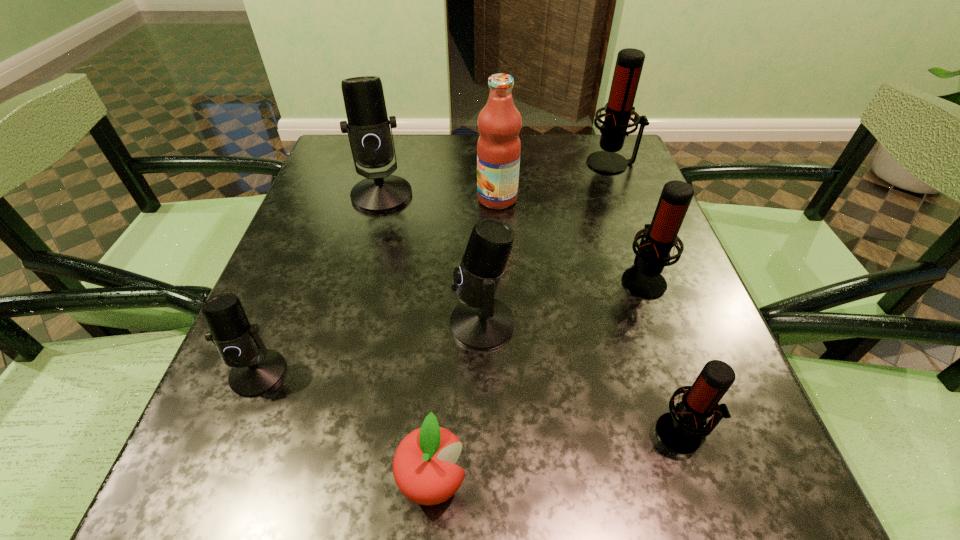
Find the location of a particular element. Image resolution: width=960 pixels, height=540 pixels. vacant space situated 0.230m on the back of the second biggest red microphone is located at coordinates (612, 193).

In order to click on vacant space located on the stand of the second farthest black microphone in this screenshot , I will do `click(306, 323)`.

You are a GUI agent. You are given a task and a screenshot of the screen. Output one action in this format:
    pyautogui.click(x=<x>, y=<y>)
    Task: Click on the blank space located 0.230m on the stand of the second farthest black microphone
    The height and width of the screenshot is (540, 960).
    Given the screenshot: What is the action you would take?
    pyautogui.click(x=318, y=323)

The height and width of the screenshot is (540, 960). What are the coordinates of `free space located on the stand of the second farthest black microphone` in the screenshot? It's located at (335, 323).

Locate an element on the screen. This screenshot has height=540, width=960. blank space located on the left of the nearest red microphone is located at coordinates (461, 433).

Locate an element on the screen. This screenshot has height=540, width=960. free space located on the stand of the fifth farthest microphone is located at coordinates (228, 449).

The image size is (960, 540). I want to click on vacant region located 0.290m on the right of the apple, so click(685, 481).

Where is `microphone located at the near edge`? The height and width of the screenshot is (540, 960). microphone located at the near edge is located at coordinates (x=681, y=431).

This screenshot has height=540, width=960. What are the coordinates of `apple present at the near edge` in the screenshot? It's located at (424, 469).

Locate an element on the screen. object located in the far left corner section of the desktop is located at coordinates (368, 128).